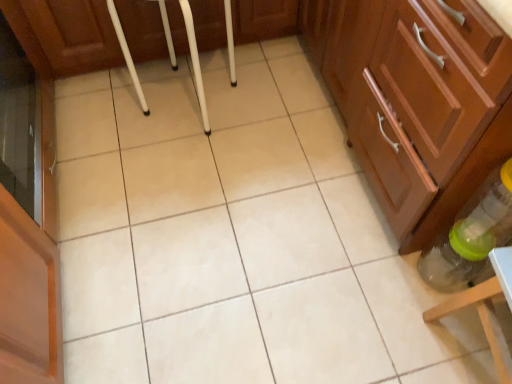
You are a GUI agent. You are given a task and a screenshot of the screen. Output one action in this format:
    pyautogui.click(x=<x>, y=<y>)
    Task: Click on the free space to the right of white plastic bar stool at center
    
    Given the screenshot: What is the action you would take?
    pyautogui.click(x=278, y=103)